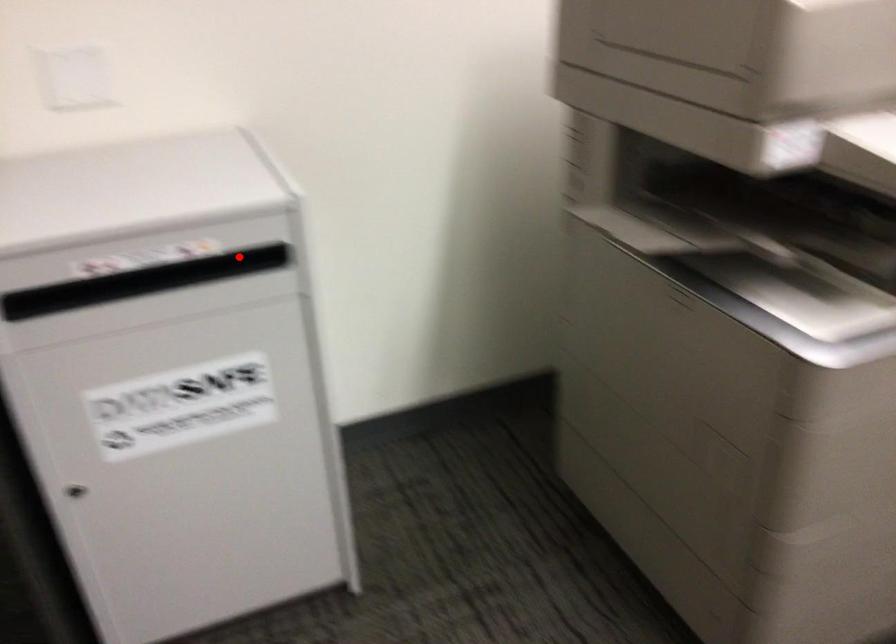
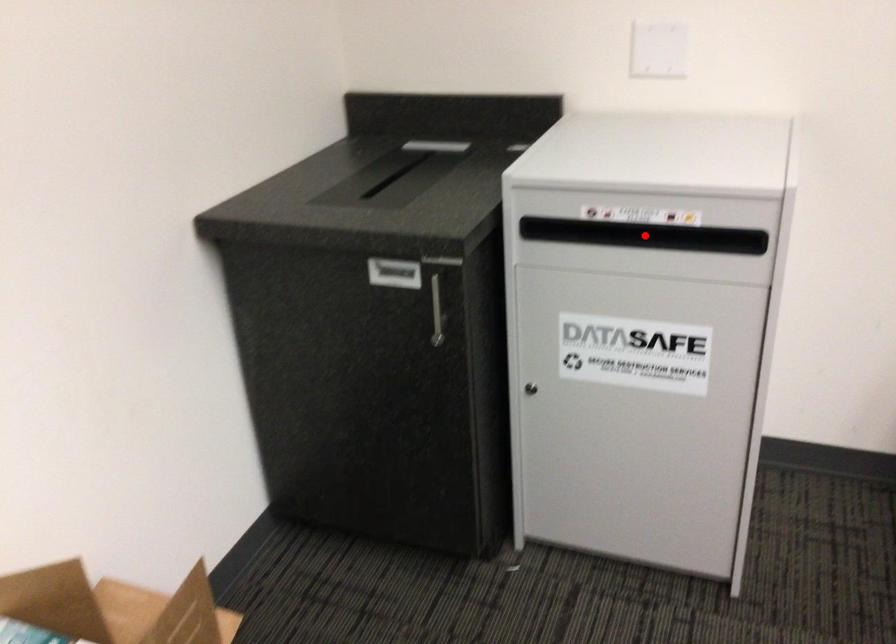
I am providing you with two images of the same scene from different viewpoints. A red point is marked on the first image and another point is marked on the second image. Does the point marked in image1 correspond to the same location as the one in image2?

No